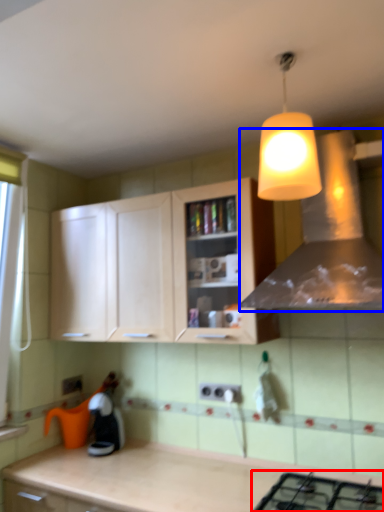
Question: Which point is closer to the camera, gas stove (highlighted by a red box) or vent (highlighted by a blue box)?

Choices:
 (A) gas stove
 (B) vent

Answer: (A)